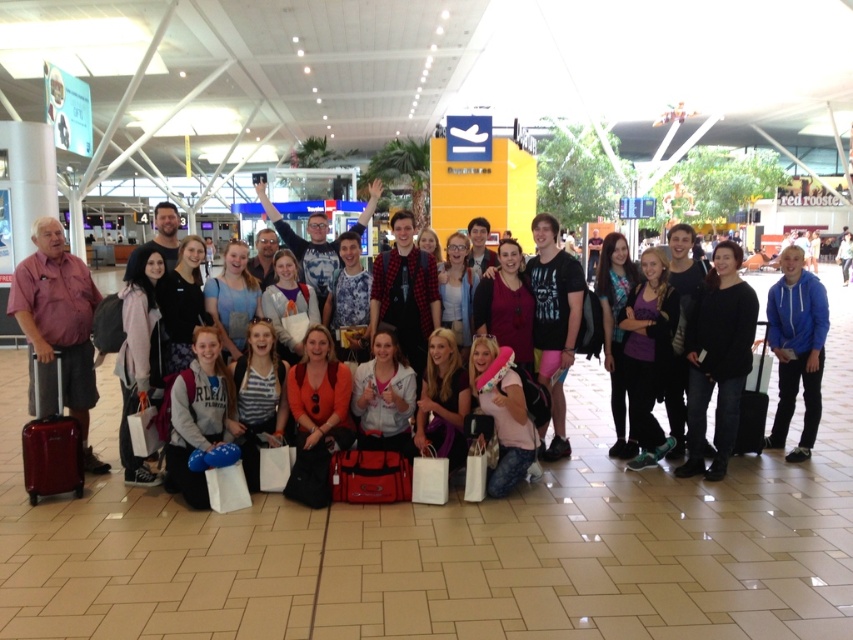
You are a photographer at the airport terminal. You need to capture a photo where the purple matte shirt at center and the black hardshell suitcase at center are both visible. Which object will appear wider in the photo?

The purple matte shirt at center will appear wider in the photo since its width surpasses that of the black hardshell suitcase at center according to the description.

You are standing at the airport terminal and want to take a photo of two points marked in the scene. The points are labeled as point 1 at coordinates [648,333] and point 2 at coordinates [763,404]. Which point is closer to your current position?

Point 1 at coordinates [648,333] is closer to your current position because it is closer to the camera than point 2 at coordinates [763,404].

You are a traveler trying to locate your luggage. You see the black matte jacket at center and the blue fleece jacket at right. Which jacket is closer to the floor?

The black matte jacket at center is closer to the floor because it is located below the blue fleece jacket at right.